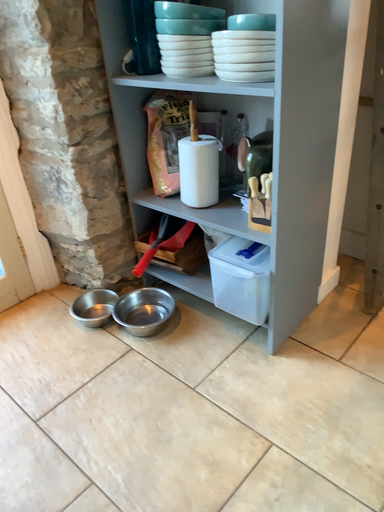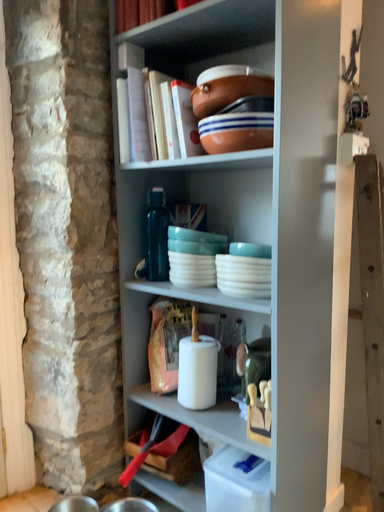
Question: Which way did the camera rotate in the video?

Choices:
 (A) rotated downward
 (B) rotated upward

Answer: (B)